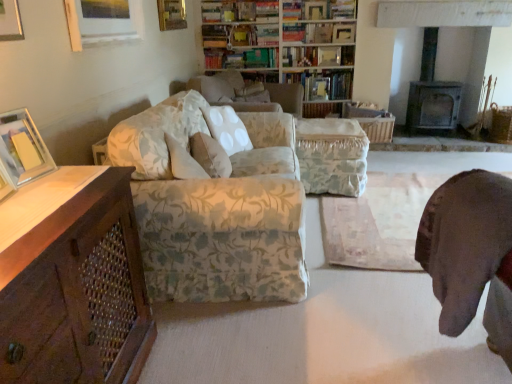
Question: From a real-world perspective, is floral fabric bookcase at upper center positioned under wooden picture frame at upper left, which ranks as the 3th picture frame in top-to-bottom order, based on gravity?

Choices:
 (A) no
 (B) yes

Answer: (B)

Question: Would you say floral fabric bookcase at upper center is a long distance from wooden picture frame at upper left, the 2th picture frame when ordered from front to back?

Choices:
 (A) no
 (B) yes

Answer: (B)

Question: From the image's perspective, is floral fabric bookcase at upper center under wooden picture frame at upper left, which ranks as the 3th picture frame in top-to-bottom order?

Choices:
 (A) no
 (B) yes

Answer: (A)

Question: Does floral fabric bookcase at upper center have a smaller size compared to wooden picture frame at upper left, which is the third picture frame in back-to-front order?

Choices:
 (A) yes
 (B) no

Answer: (B)

Question: Considering the relative sizes of floral fabric bookcase at upper center and wooden picture frame at upper left, the 2th picture frame when ordered from front to back, in the image provided, is floral fabric bookcase at upper center taller than wooden picture frame at upper left, the 2th picture frame when ordered from front to back,?

Choices:
 (A) yes
 (B) no

Answer: (A)

Question: Considering the positions of floral fabric ottoman at center and wooden picture frame at upper center, the first picture frame when ordered from top to bottom, in the image, is floral fabric ottoman at center bigger or smaller than wooden picture frame at upper center, the first picture frame when ordered from top to bottom,?

Choices:
 (A) small
 (B) big

Answer: (B)

Question: Looking at their shapes, would you say floral fabric ottoman at center is wider or thinner than wooden picture frame at upper center, the first picture frame from the right?

Choices:
 (A) thin
 (B) wide

Answer: (B)

Question: Is floral fabric ottoman at center in front of or behind wooden picture frame at upper center, the 4th picture frame viewed from the front, in the image?

Choices:
 (A) behind
 (B) front

Answer: (B)

Question: Is floral fabric ottoman at center to the left or to the right of wooden picture frame at upper center, the fourth picture frame when ordered from left to right, in the image?

Choices:
 (A) right
 (B) left

Answer: (B)

Question: Is hardcover books at upper center, which is the fourth book in top-to-bottom order, taller or shorter than hardcover book at upper center, which is the 3th book from bottom to top?

Choices:
 (A) tall
 (B) short

Answer: (A)

Question: Considering the positions of hardcover books at upper center, which ranks as the 2th book in bottom-to-top order, and hardcover book at upper center, which is the 3th book from bottom to top, in the image, is hardcover books at upper center, which ranks as the 2th book in bottom-to-top order, bigger or smaller than hardcover book at upper center, which is the 3th book from bottom to top,?

Choices:
 (A) big
 (B) small

Answer: (A)

Question: From a real-world perspective, is hardcover books at upper center, which ranks as the 2th book in bottom-to-top order, positioned above or below hardcover book at upper center, acting as the 3th book starting from the top?

Choices:
 (A) below
 (B) above

Answer: (A)

Question: Is point (224, 62) positioned closer to the camera than point (289, 48)?

Choices:
 (A) closer
 (B) farther

Answer: (B)

Question: From a real-world perspective, is floral fabric ottoman at center positioned above or below hardcover book at upper center, which is the 3th book from bottom to top?

Choices:
 (A) below
 (B) above

Answer: (A)

Question: Choose the correct answer: Is floral fabric ottoman at center inside hardcover book at upper center, acting as the 3th book starting from the top, or outside it?

Choices:
 (A) inside
 (B) outside

Answer: (B)